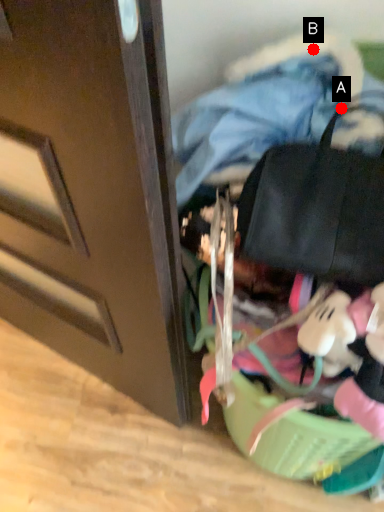
Question: Two points are circled on the image, labeled by A and B beside each circle. Which point appears farthest from the camera in this image?

Choices:
 (A) A is further
 (B) B is further

Answer: (A)